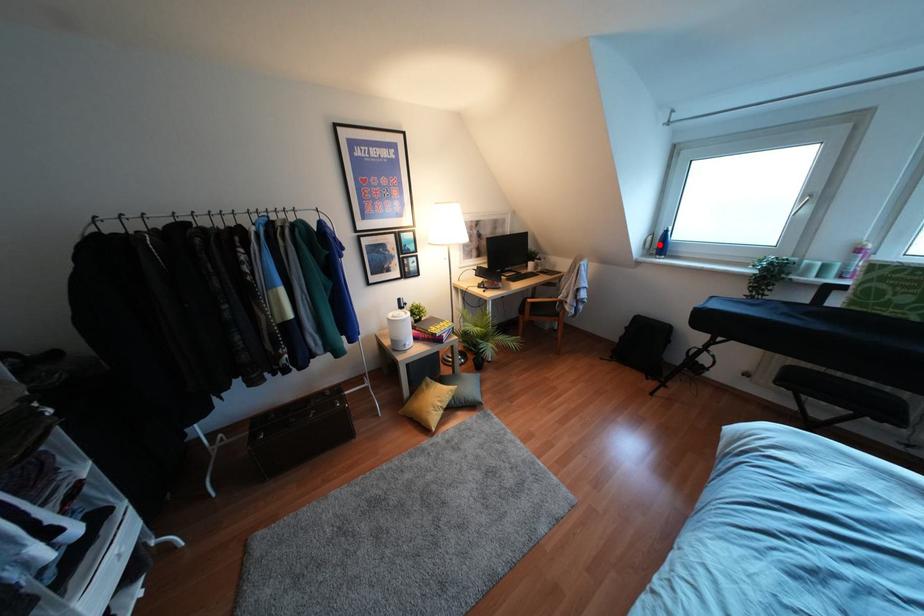
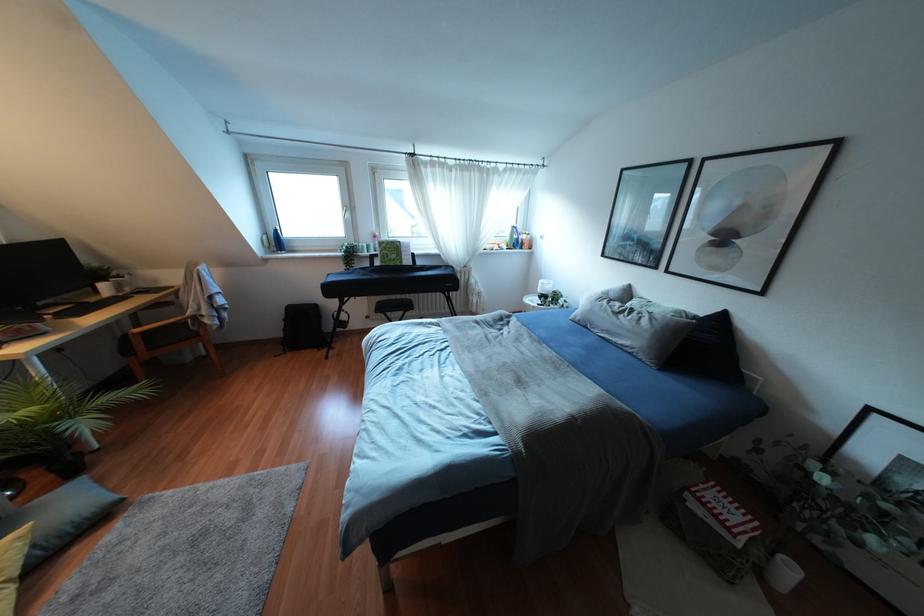
Question: A red point is marked in image1. In image2, is the corresponding 3D point closer to the camera or farther? Reply with the corresponding letter.

Choices:
 (A) The corresponding 3D point is closer.
 (B) The corresponding 3D point is farther.

Answer: (B)